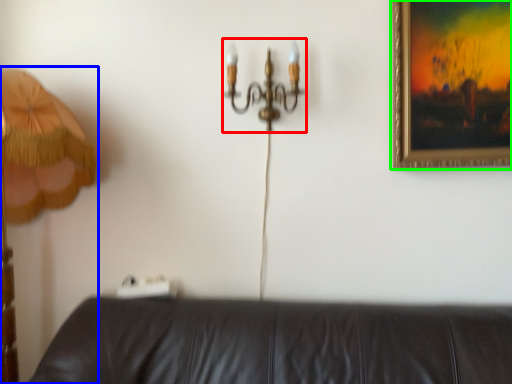
Question: Which is farther away from chandelier (highlighted by a red box)? lamp (highlighted by a blue box) or picture frame (highlighted by a green box)?

Choices:
 (A) lamp
 (B) picture frame

Answer: (A)